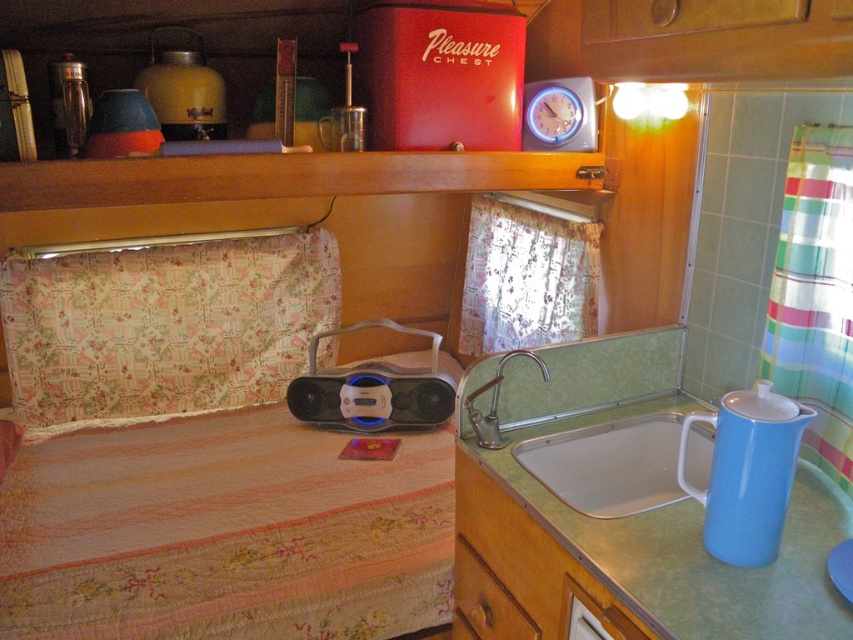
Question: Among these objects, which one is nearest to the camera?

Choices:
 (A) floral fabric bed at center
 (B) floral fabric pillow at left
 (C) brushed metal faucet at sink center

Answer: (A)

Question: Which of the following is the closest to the observer?

Choices:
 (A) (563, 232)
 (B) (490, 593)
 (C) (115, 404)

Answer: (B)

Question: Which point is farther to the camera?

Choices:
 (A) green matte drawer at lower center
 (B) white glossy sink at lower center

Answer: (B)

Question: Is multicolored striped fabric at right smaller than wooden drawer at lower center?

Choices:
 (A) yes
 (B) no

Answer: (B)

Question: Is multicolored striped fabric at right positioned at the back of brushed metal faucet at sink center?

Choices:
 (A) yes
 (B) no

Answer: (B)

Question: Does green laminate countertop at lower right have a larger size compared to floral fabric pillow at left?

Choices:
 (A) no
 (B) yes

Answer: (B)